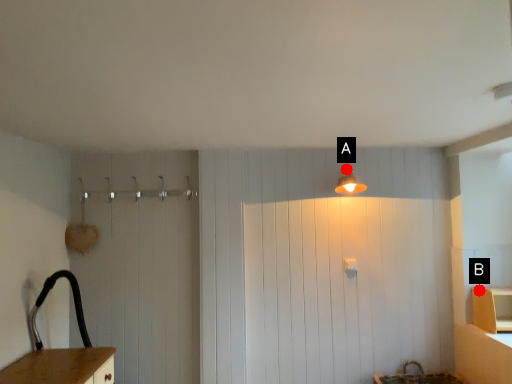
Question: Two points are circled on the image, labeled by A and B beside each circle. Which point is closer to the camera?

Choices:
 (A) A is closer
 (B) B is closer

Answer: (B)